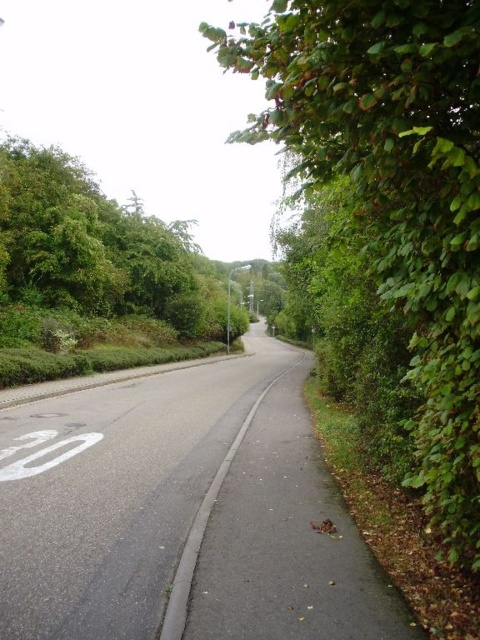
In the scene shown: You are a pedestrian standing on the road and want to walk towards the denser vegetation on the left. Which tree, the green leafy tree at right or the green leafy tree at left, is narrower in width?

The green leafy tree at right is narrower than the green leafy tree at left.